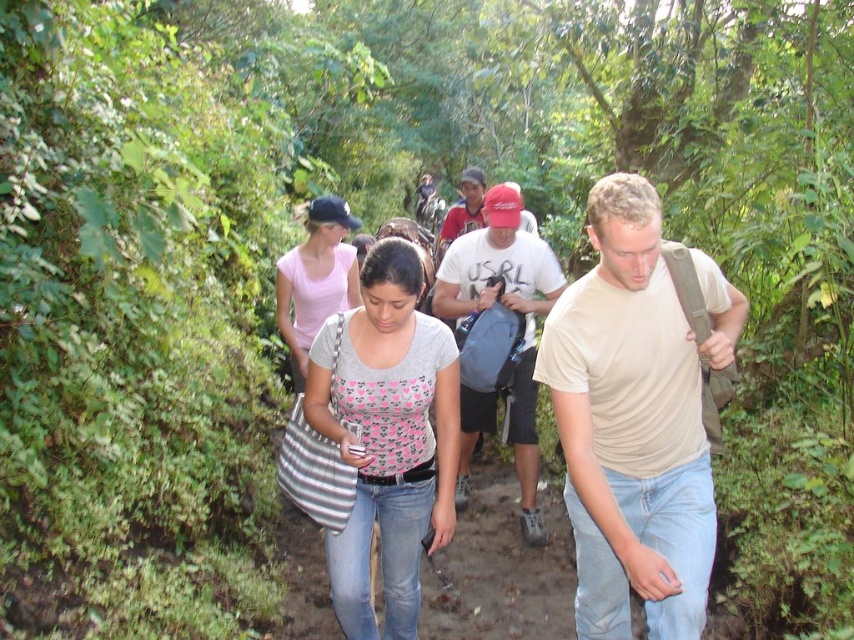
Question: Is beige cotton shirt at center behind pink cotton shirt at center?

Choices:
 (A) yes
 (B) no

Answer: (B)

Question: Does beige cotton shirt at center have a smaller size compared to gray printed shirt at center?

Choices:
 (A) yes
 (B) no

Answer: (B)

Question: Based on their relative distances, which object is farther from the matte gray backpack at center?

Choices:
 (A) beige cotton shirt at center
 (B) gray printed shirt at center
 (C) pink cotton shirt at center

Answer: (A)

Question: Does beige cotton shirt at center appear under matte gray backpack at center?

Choices:
 (A) yes
 (B) no

Answer: (A)

Question: Which point is closer to the camera?

Choices:
 (A) (389, 536)
 (B) (646, 588)
 (C) (326, 253)

Answer: (B)

Question: Estimate the real-world distances between objects in this image. Which object is closer to the matte gray backpack at center?

Choices:
 (A) pink cotton shirt at center
 (B) gray printed shirt at center
 (C) beige cotton shirt at center

Answer: (A)